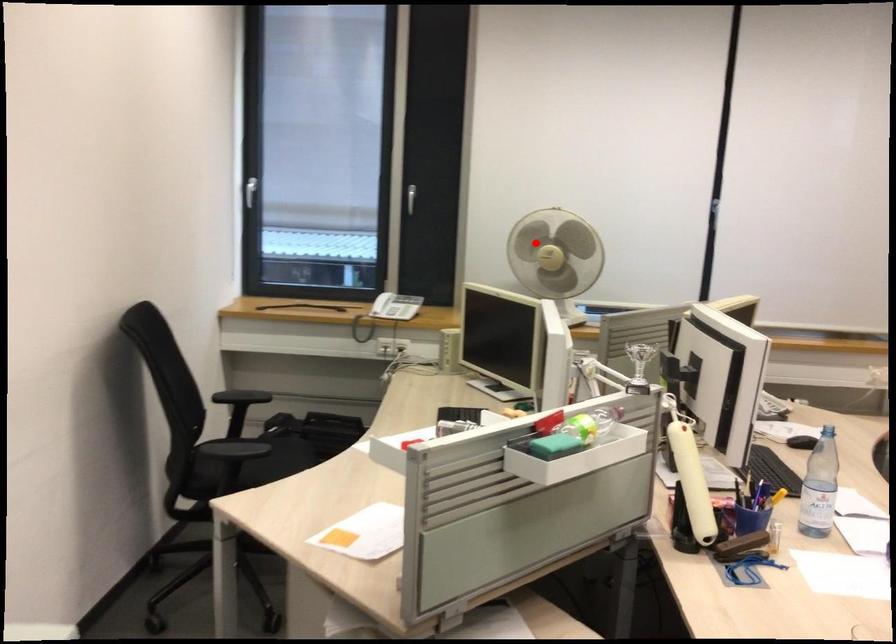
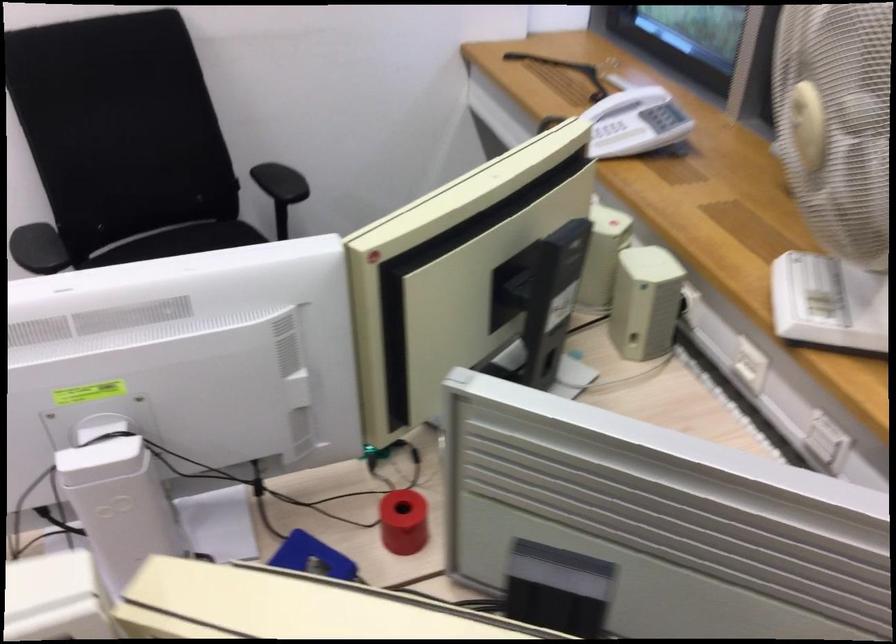
Question: I am providing you with two images of the same scene from different viewpoints. In image1, a red point is highlighted. Considering the same 3D point in image2, which of the following is correct?

Choices:
 (A) It is closer
 (B) It is farther

Answer: (A)